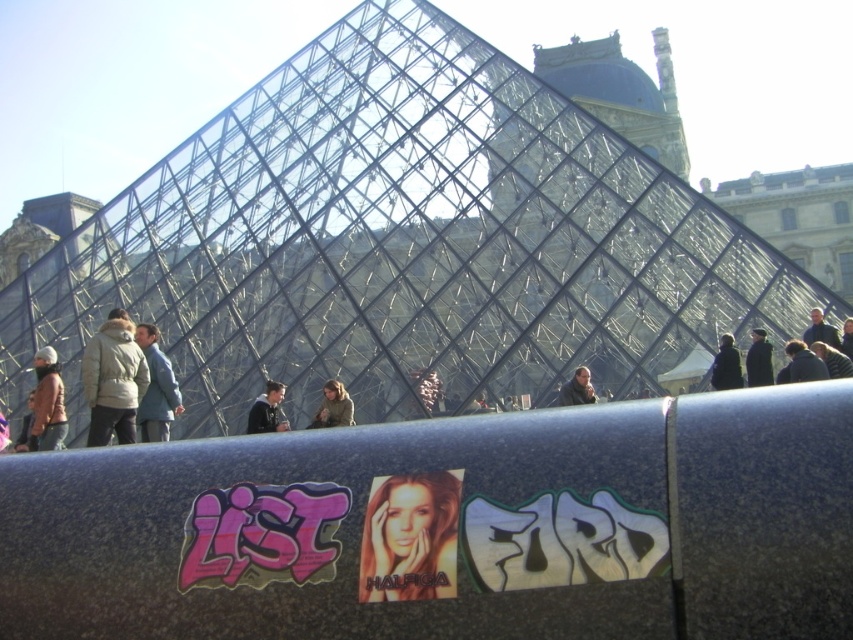
Question: Does smooth glossy poster at center appear on the left side of light brown hair at upper right?

Choices:
 (A) no
 (B) yes

Answer: (B)

Question: Which point is closer to the camera?

Choices:
 (A) (270, 397)
 (B) (378, 596)
 (C) (88, 440)

Answer: (B)

Question: Can you confirm if brown woolen hat at left is positioned below dark blue jacket at center?

Choices:
 (A) no
 (B) yes

Answer: (A)

Question: Which object is farther from the camera taking this photo?

Choices:
 (A) camouflage jacket at center
 (B) white puffy jacket at left
 (C) dark blue jeans at center
 (D) dark blue jacket at center

Answer: (A)

Question: Estimate the real-world distances between objects in this image. Which object is closer to the brown woolen hat at left?

Choices:
 (A) light brown leather jacket at lower left
 (B) dark wool coat at center

Answer: (A)

Question: Observing the image, what is the correct spatial positioning of dark blue jacket at center in reference to light brown leather jacket at lower left?

Choices:
 (A) above
 (B) below

Answer: (A)